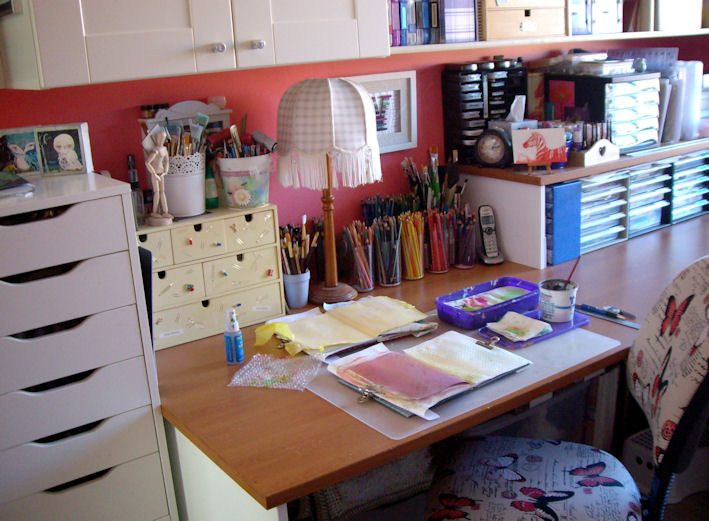
I want to click on storage cart, so 64,409.